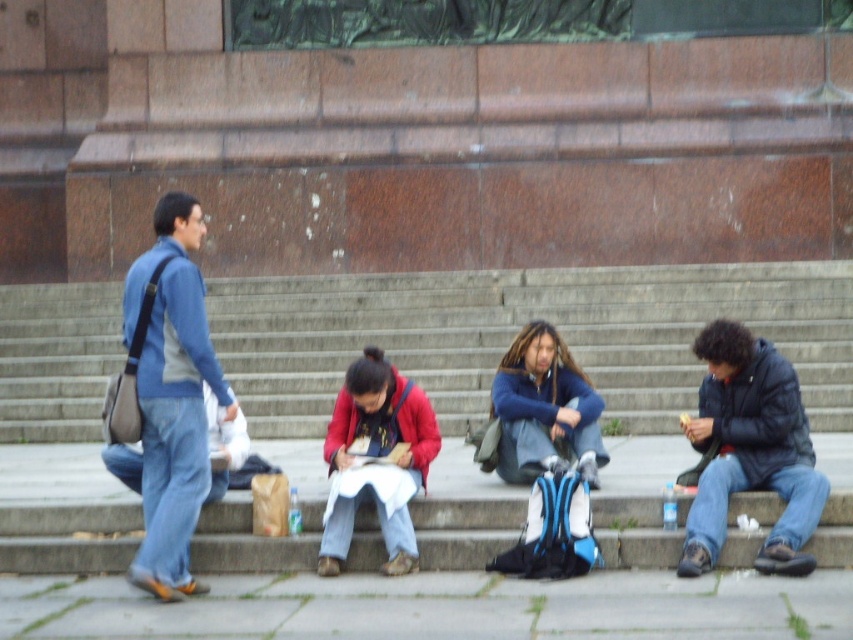
You are standing on the stone steps and want to borrow a jacket from either the matte red jacket at center or the matte blue jacket at center. Which jacket would you choose if you want the one that is bigger in size?

The matte red jacket at center is larger in size compared to the matte blue jacket at center, so you should choose the matte red jacket at center.